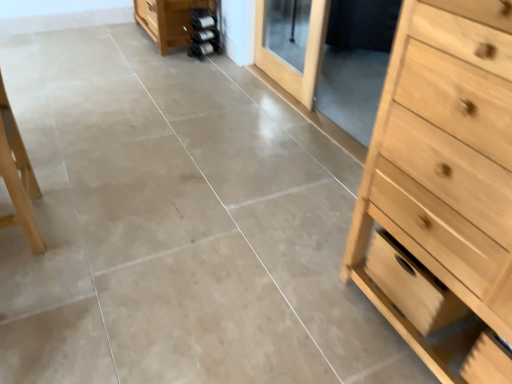
Question: Considering the relative sizes of light wood drawer at right and light brown wooden screen door at upper center in the image provided, is light wood drawer at right smaller than light brown wooden screen door at upper center?

Choices:
 (A) no
 (B) yes

Answer: (B)

Question: From a real-world perspective, is light wood drawer at right under light brown wooden screen door at upper center?

Choices:
 (A) no
 (B) yes

Answer: (B)

Question: Considering the relative sizes of light wood drawer at right and light brown wooden screen door at upper center in the image provided, is light wood drawer at right shorter than light brown wooden screen door at upper center?

Choices:
 (A) no
 (B) yes

Answer: (B)

Question: Is light wood drawer at right positioned in front of light brown wooden screen door at upper center?

Choices:
 (A) yes
 (B) no

Answer: (A)

Question: Is light wood drawer at right bigger than light brown wooden screen door at upper center?

Choices:
 (A) yes
 (B) no

Answer: (B)

Question: From the image's perspective, is light brown wooden screen door at upper center above or below light wood drawer at right?

Choices:
 (A) below
 (B) above

Answer: (B)

Question: From their relative heights in the image, would you say light brown wooden screen door at upper center is taller or shorter than light wood drawer at right?

Choices:
 (A) short
 (B) tall

Answer: (B)

Question: Would you say light brown wooden screen door at upper center is inside or outside light wood drawer at right?

Choices:
 (A) outside
 (B) inside

Answer: (A)

Question: From a real-world perspective, is light brown wooden screen door at upper center above or below light wood drawer at right?

Choices:
 (A) below
 (B) above

Answer: (B)

Question: From a real-world perspective, relative to light brown wooden screen door at upper center, is light wood drawer at right vertically above or below?

Choices:
 (A) below
 (B) above

Answer: (A)

Question: From the image's perspective, relative to light brown wooden screen door at upper center, is light wood drawer at right above or below?

Choices:
 (A) above
 (B) below

Answer: (B)

Question: Looking at the image, does light wood drawer at right seem bigger or smaller compared to light brown wooden screen door at upper center?

Choices:
 (A) small
 (B) big

Answer: (A)

Question: Considering the positions of light wood drawer at right and light brown wooden screen door at upper center in the image, is light wood drawer at right wider or thinner than light brown wooden screen door at upper center?

Choices:
 (A) thin
 (B) wide

Answer: (B)

Question: In terms of size, does light brown wooden screen door at upper center appear bigger or smaller than light wood chest of drawers at right?

Choices:
 (A) small
 (B) big

Answer: (A)

Question: From a real-world perspective, is light brown wooden screen door at upper center physically located above or below light wood chest of drawers at right?

Choices:
 (A) below
 (B) above

Answer: (A)